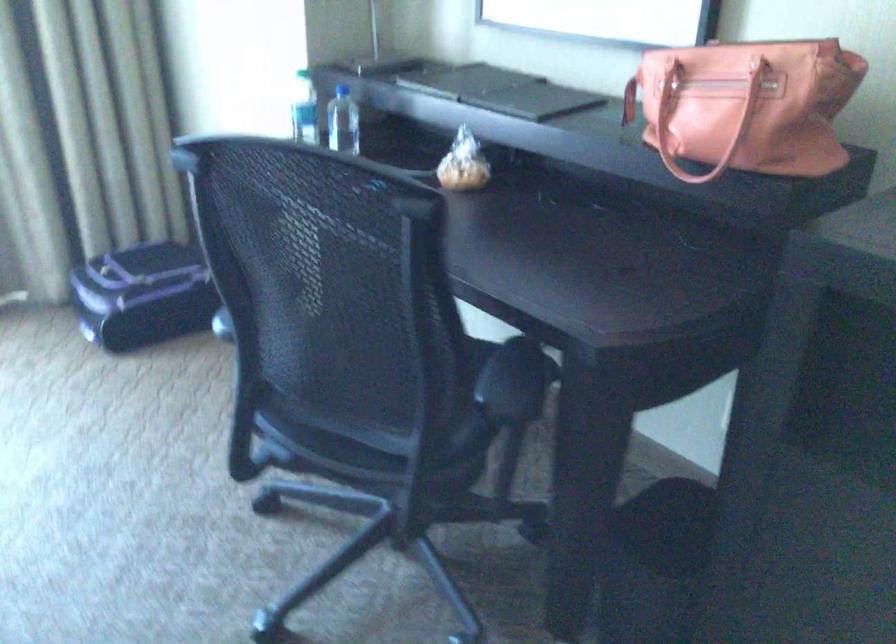
Identify the location of orange handbag handle. (704, 122).